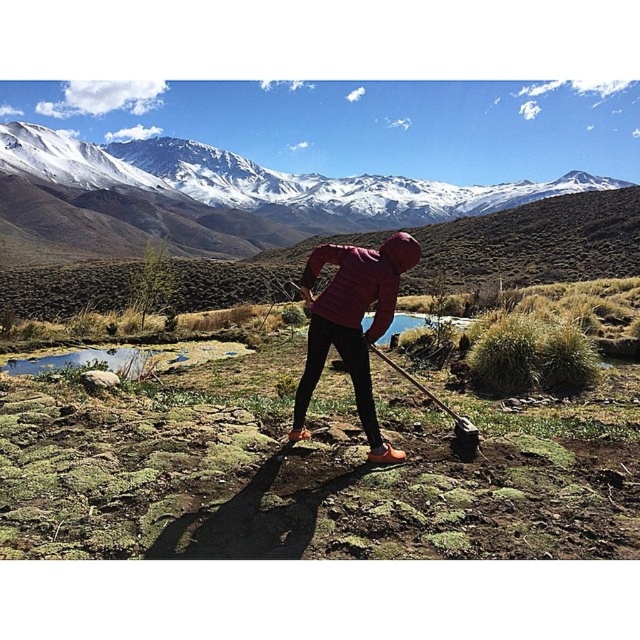
Question: Where is snowy white mountain at upper center located in relation to matte pink jacket at center in the image?

Choices:
 (A) above
 (B) below

Answer: (A)

Question: Which object is closer to the camera taking this photo?

Choices:
 (A) matte pink jacket at center
 (B) wooden shovel at center
 (C) snowy white mountain at upper center

Answer: (B)

Question: Does snowy white mountain at upper center appear on the right side of matte pink jacket at center?

Choices:
 (A) no
 (B) yes

Answer: (B)

Question: Which point is closer to the camera?

Choices:
 (A) matte pink jacket at center
 (B) wooden shovel at center
 (C) snowy white mountain at upper center

Answer: (B)

Question: Can you confirm if matte pink jacket at center is positioned below wooden shovel at center?

Choices:
 (A) yes
 (B) no

Answer: (A)

Question: Which object is closer to the camera taking this photo?

Choices:
 (A) wooden shovel at center
 (B) snowy white mountain at upper center
 (C) matte pink jacket at center

Answer: (A)